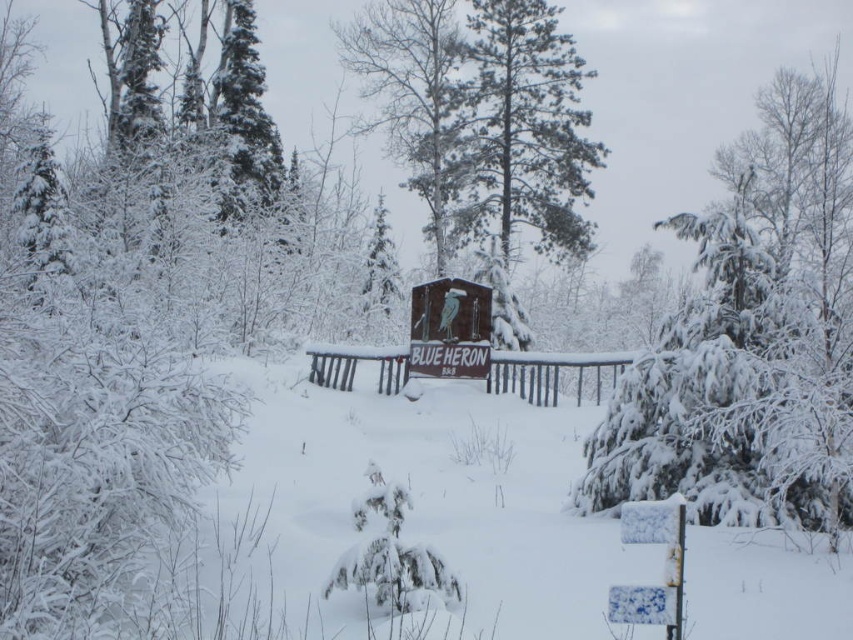
Is snow-covered evergreen at center to the right of snow-covered pine tree at center from the viewer's perspective?

Yes, snow-covered evergreen at center is to the right of snow-covered pine tree at center.

You are a GUI agent. You are given a task and a screenshot of the screen. Output one action in this format:
    pyautogui.click(x=<x>, y=<y>)
    Task: Click on the snow-covered evergreen at center
    
    Given the screenshot: What is the action you would take?
    pyautogui.click(x=751, y=339)

Between point (798, 406) and point (450, 177), which one is positioned behind?

Positioned behind is point (450, 177).

This screenshot has width=853, height=640. Find the location of `snow-covered evergreen at center`. snow-covered evergreen at center is located at coordinates 751,339.

Is point (292, 525) positioned in front of point (413, 189)?

That is True.

Which of these two, white fluffy snow at center or snow-covered pine tree at center, stands shorter?

white fluffy snow at center

Who is more forward, (315, 440) or (419, 115)?

Point (315, 440) is in front.

You are a GUI agent. You are given a task and a screenshot of the screen. Output one action in this format:
    pyautogui.click(x=<x>, y=<y>)
    Task: Click on the white fluffy snow at center
    The width and height of the screenshot is (853, 640).
    Given the screenshot: What is the action you would take?
    pyautogui.click(x=426, y=499)

Between white fluffy snow at center and snow-covered evergreen at center, which one appears on the left side from the viewer's perspective?

From the viewer's perspective, white fluffy snow at center appears more on the left side.

Between white fluffy snow at center and snow-covered evergreen at center, which one is positioned lower?

white fluffy snow at center is lower down.

Who is more forward, (x=281, y=433) or (x=676, y=452)?

Point (x=676, y=452) is more forward.

Find the location of a particular element. The height and width of the screenshot is (640, 853). white fluffy snow at center is located at coordinates (426, 499).